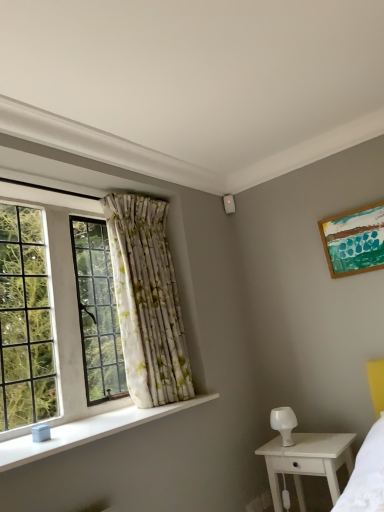
Where is `white floral fabric curtain at left`? This screenshot has width=384, height=512. white floral fabric curtain at left is located at coordinates (147, 301).

This screenshot has height=512, width=384. In order to click on white glossy lamp at lower right in this screenshot , I will do `click(284, 423)`.

Locate an element on the screen. white floral fabric curtain at left is located at coordinates (147, 301).

From the image's perspective, is white floral fabric curtain at left located above white smooth window sill at lower left?

Indeed, from the image's perspective, white floral fabric curtain at left is shown above white smooth window sill at lower left.

From a real-world perspective, which is physically above, white floral fabric curtain at left or white smooth window sill at lower left?

white floral fabric curtain at left is physically above.

Which is closer, (158, 270) or (101, 437)?

Point (101, 437)

Is white floral fabric curtain at left at the left side of white smooth window sill at lower left?

No.

In the scene shown: Could you tell me if white smooth window sill at lower left is turned towards white glossy lamp at lower right?

No, white smooth window sill at lower left is not aimed at white glossy lamp at lower right.

Which of these two, white smooth window sill at lower left or white glossy lamp at lower right, is thinner?

white glossy lamp at lower right is thinner.

Looking at this image, from the image's perspective, is white smooth window sill at lower left located above or below white glossy lamp at lower right?

From the image's perspective, white smooth window sill at lower left appears above white glossy lamp at lower right.

From a real-world perspective, is white smooth window sill at lower left below white glossy lamp at lower right?

Incorrect, from a real-world perspective, white smooth window sill at lower left is higher than white glossy lamp at lower right.

This screenshot has width=384, height=512. In order to click on curtain below the wooden picture frame at upper right (from a real-world perspective) in this screenshot , I will do `click(147, 301)`.

From the picture: Is white floral fabric curtain at left further to the viewer compared to wooden picture frame at upper right?

That is False.

From the picture: From the image's perspective, between white floral fabric curtain at left and wooden picture frame at upper right, which one is located above?

wooden picture frame at upper right is shown above in the image.

Is white floral fabric curtain at left located outside wooden picture frame at upper right?

Yes, white floral fabric curtain at left is outside of wooden picture frame at upper right.

Are white smooth window sill at lower left and white wood nightstand at lower right beside each other?

No, white smooth window sill at lower left is not making contact with white wood nightstand at lower right.

Between white smooth window sill at lower left and white wood nightstand at lower right, which one has less height?

With less height is white smooth window sill at lower left.

Considering the points (133, 419) and (305, 446), which point is behind, point (133, 419) or point (305, 446)?

The point (305, 446) is behind.

From the picture: How different are the orientations of white smooth window sill at lower left and white wood nightstand at lower right in degrees?

The facing directions of white smooth window sill at lower left and white wood nightstand at lower right are 88.8 degrees apart.

In the scene shown: Who is taller, white glossy lamp at lower right or white floral fabric curtain at left?

With more height is white floral fabric curtain at left.

Is white glossy lamp at lower right far from white floral fabric curtain at left?

No.

From a real-world perspective, relative to white floral fabric curtain at left, is white glossy lamp at lower right vertically above or below?

white glossy lamp at lower right is below white floral fabric curtain at left.

Does white glossy lamp at lower right have a larger size compared to white floral fabric curtain at left?

No.

Does point (78, 442) appear closer or farther from the camera than point (77, 347)?

Point (78, 442) is closer to the camera than point (77, 347).

From a real-world perspective, is white smooth window sill at lower left on clear glass window at left?

No, from a real-world perspective, white smooth window sill at lower left is not over clear glass window at left

Based on their positions, is white smooth window sill at lower left located to the left or right of clear glass window at left?

Based on their positions, white smooth window sill at lower left is located to the right of clear glass window at left.

Is white smooth window sill at lower left outside of clear glass window at left?

Yes, white smooth window sill at lower left is located beyond the bounds of clear glass window at left.

Is wooden picture frame at upper right not within white wood nightstand at lower right?

Yes.

From a real-world perspective, is wooden picture frame at upper right beneath white wood nightstand at lower right?

No, from a real-world perspective, wooden picture frame at upper right is not below white wood nightstand at lower right.

Considering the sizes of objects wooden picture frame at upper right and white wood nightstand at lower right in the image provided, who is thinner, wooden picture frame at upper right or white wood nightstand at lower right?

With smaller width is wooden picture frame at upper right.

Measure the distance from wooden picture frame at upper right to white wood nightstand at lower right.

They are 1.07 meters apart.

The height and width of the screenshot is (512, 384). Identify the location of window sill below the white floral fabric curtain at left (from a real-world perspective). (86, 431).

I want to click on window sill above the white glossy lamp at lower right (from a real-world perspective), so [86, 431].

From the image, which object appears to be nearer to white smooth window sill at lower left, clear glass window at left or white floral fabric curtain at left?

clear glass window at left.

When comparing their distances from white glossy lamp at lower right, does wooden picture frame at upper right or clear glass window at left seem further?

Among the two, clear glass window at left is located further to white glossy lamp at lower right.

Estimate the real-world distances between objects in this image. Which object is further from white wood nightstand at lower right, white smooth window sill at lower left or wooden picture frame at upper right?

wooden picture frame at upper right lies further to white wood nightstand at lower right than the other object.

Estimate the real-world distances between objects in this image. Which object is closer to white glossy lamp at lower right, white wood nightstand at lower right or white smooth window sill at lower left?

Based on the image, white wood nightstand at lower right appears to be nearer to white glossy lamp at lower right.

Consider the image. Based on their spatial positions, is wooden picture frame at upper right or clear glass window at left closer to white smooth window sill at lower left?

clear glass window at left is positioned closer to the anchor white smooth window sill at lower left.

When comparing their distances from wooden picture frame at upper right, does clear glass window at left or white glossy lamp at lower right seem further?

clear glass window at left lies further to wooden picture frame at upper right than the other object.

Estimate the real-world distances between objects in this image. Which object is closer to white floral fabric curtain at left, white glossy lamp at lower right or white smooth window sill at lower left?

white smooth window sill at lower left lies closer to white floral fabric curtain at left than the other object.

Looking at the image, which one is located closer to white smooth window sill at lower left, white glossy lamp at lower right or wooden picture frame at upper right?

white glossy lamp at lower right is positioned closer to the anchor white smooth window sill at lower left.

Find the location of a particular element. The image size is (384, 512). lamp between white floral fabric curtain at left and wooden picture frame at upper right in the horizontal direction is located at coordinates (284, 423).

You are a GUI agent. You are given a task and a screenshot of the screen. Output one action in this format:
    pyautogui.click(x=<x>, y=<y>)
    Task: Click on the curtain between clear glass window at left and white glossy lamp at lower right
    The width and height of the screenshot is (384, 512).
    Given the screenshot: What is the action you would take?
    pyautogui.click(x=147, y=301)

You are a GUI agent. You are given a task and a screenshot of the screen. Output one action in this format:
    pyautogui.click(x=<x>, y=<y>)
    Task: Click on the window sill located between clear glass window at left and white glossy lamp at lower right in the left-right direction
    The height and width of the screenshot is (512, 384).
    Given the screenshot: What is the action you would take?
    pyautogui.click(x=86, y=431)

Image resolution: width=384 pixels, height=512 pixels. I want to click on curtain between clear glass window at left and white smooth window sill at lower left in the vertical direction, so click(147, 301).